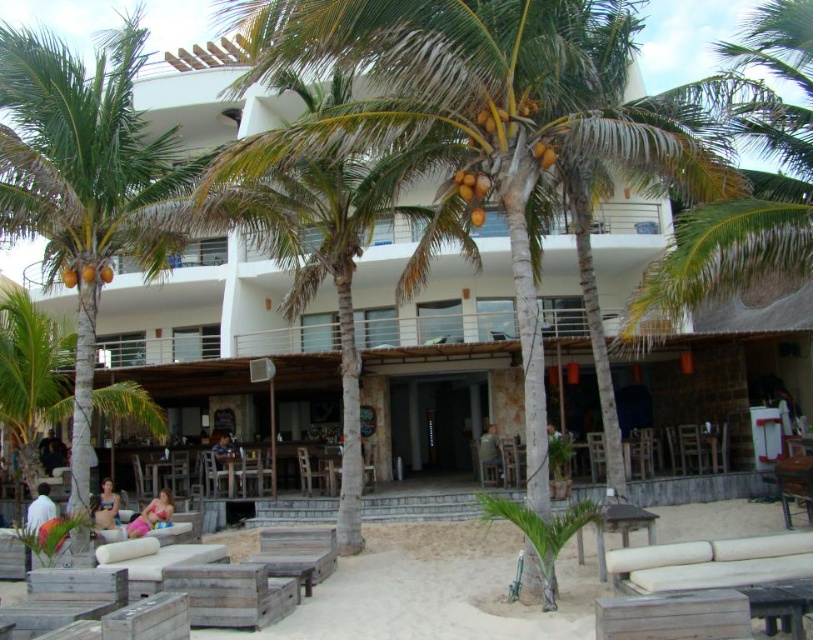
Question: Can you confirm if green leafy palm tree at left is positioned to the left of white matte shirt at lower left?

Choices:
 (A) yes
 (B) no

Answer: (A)

Question: Which of the following is the farthest from the observer?

Choices:
 (A) (401, 605)
 (B) (46, 520)
 (C) (168, 500)

Answer: (C)

Question: Where is green leafy palm tree at center located in relation to wooden chair at center in the image?

Choices:
 (A) above
 (B) below

Answer: (A)

Question: Is the position of green leafy palm tree at left less distant than that of pink fabric bikini at lower center?

Choices:
 (A) yes
 (B) no

Answer: (A)

Question: Which object is closer to the camera taking this photo?

Choices:
 (A) wooden lounge chairs at lower center
 (B) light brown wooden chair at center
 (C) wooden chair at center
 (D) pink fabric bikini at lower center

Answer: (A)

Question: Among these points, which one is farthest from the camera?

Choices:
 (A) (364, 524)
 (B) (133, 536)

Answer: (A)